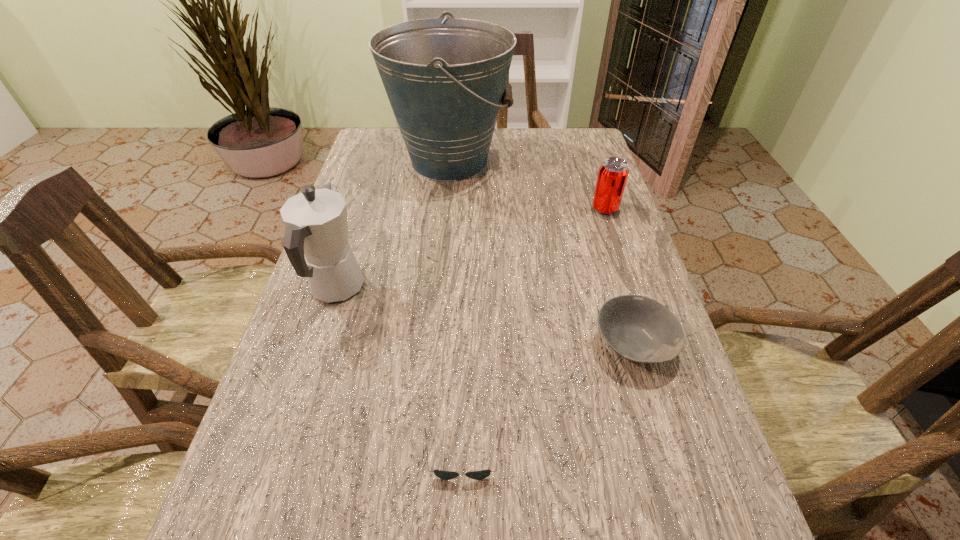
Image resolution: width=960 pixels, height=540 pixels. In order to click on free space at the right edge of the desktop in this screenshot , I will do `click(689, 408)`.

I want to click on free location at the far left corner of the desktop, so click(399, 143).

Image resolution: width=960 pixels, height=540 pixels. In the image, there is a desktop. Find the location of `free region at the far right corner`. free region at the far right corner is located at coordinates (542, 127).

The height and width of the screenshot is (540, 960). What are the coordinates of `vacant area between the fourth nearest object and the fourth tallest object` in the screenshot? It's located at (619, 276).

The width and height of the screenshot is (960, 540). Identify the location of free space between the bowl and the nearest object. (548, 400).

Locate an element on the screen. The width and height of the screenshot is (960, 540). vacant region between the coffeepot and the bowl is located at coordinates (485, 316).

At what (x,y) coordinates should I click in order to perform the action: click on empty space between the coffeepot and the fourth tallest object. Please return your answer as a coordinate pair (x, y). The image size is (960, 540). Looking at the image, I should click on pos(485,316).

Where is `free space between the second shortest object and the fourth shortest object`? Image resolution: width=960 pixels, height=540 pixels. free space between the second shortest object and the fourth shortest object is located at coordinates (485, 316).

Where is `vacant region between the soda can and the bucket`? The height and width of the screenshot is (540, 960). vacant region between the soda can and the bucket is located at coordinates (527, 185).

Where is `free point between the tallest object and the bowl`? This screenshot has width=960, height=540. free point between the tallest object and the bowl is located at coordinates (541, 253).